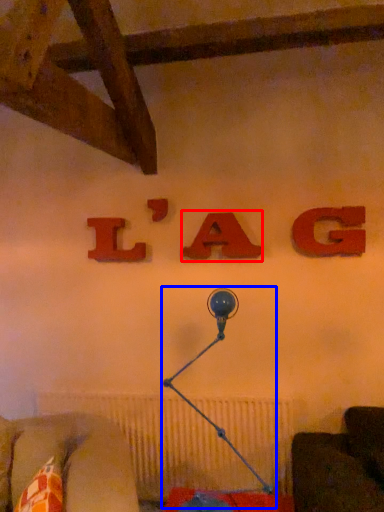
Question: Which object appears closest to the camera in this image, alphabet (highlighted by a red box) or table lamp (highlighted by a blue box)?

Choices:
 (A) alphabet
 (B) table lamp

Answer: (B)